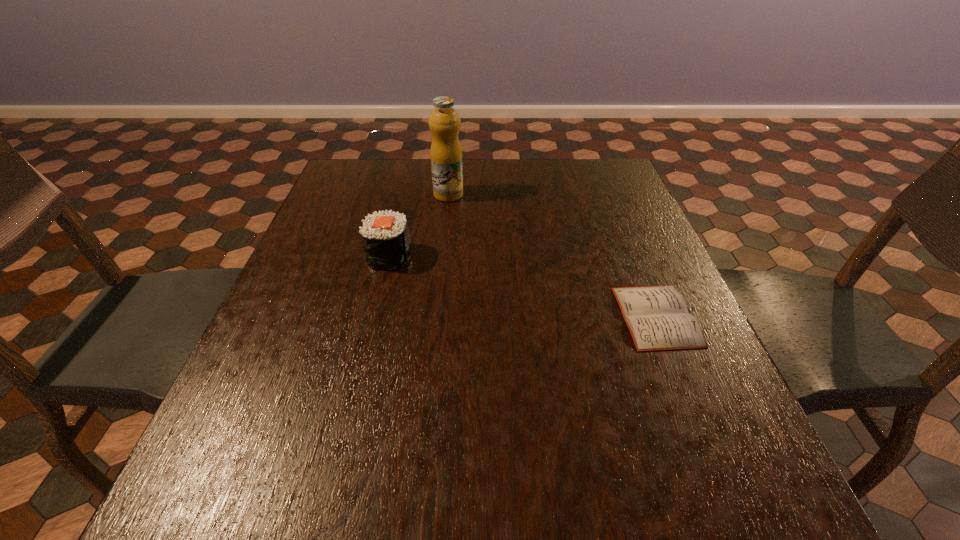
Where is `the second object from left to right`? This screenshot has width=960, height=540. the second object from left to right is located at coordinates (444, 122).

Where is `the tallest object`? the tallest object is located at coordinates 444,122.

Locate an element on the screen. Image resolution: width=960 pixels, height=540 pixels. the second farthest object is located at coordinates [x=385, y=236].

Locate an element on the screen. The width and height of the screenshot is (960, 540). the second shortest object is located at coordinates (385, 236).

In order to click on the shortest object in this screenshot , I will do `click(657, 317)`.

I want to click on diary, so click(x=657, y=317).

Identify the location of vacant space located on the front label of the farthest object. (539, 194).

Where is `vacant space positioned 0.300m on the right of the leftmost object`? This screenshot has height=540, width=960. vacant space positioned 0.300m on the right of the leftmost object is located at coordinates (534, 256).

I want to click on vacant area located 0.150m on the front of the shortest object, so click(x=699, y=422).

Locate an element on the screen. object that is positioned at the far edge is located at coordinates (444, 122).